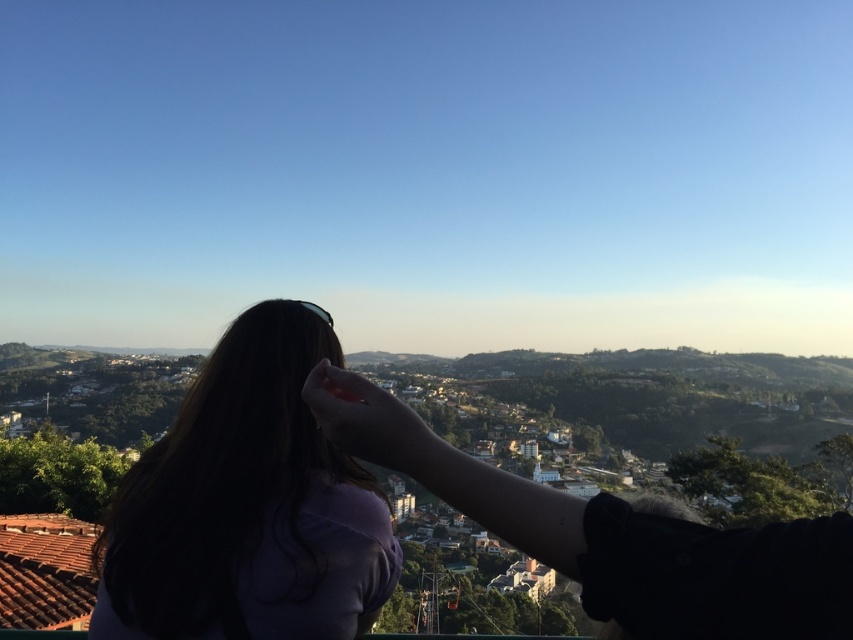
Question: Is dark purple shirt at center positioned before matte pink hand at center?

Choices:
 (A) no
 (B) yes

Answer: (B)

Question: Can you confirm if dark purple shirt at center is positioned below matte pink hand at center?

Choices:
 (A) yes
 (B) no

Answer: (A)

Question: Is dark purple shirt at center wider than matte pink hand at center?

Choices:
 (A) yes
 (B) no

Answer: (A)

Question: Which point is closer to the camera?

Choices:
 (A) dark purple shirt at center
 (B) matte pink hand at center

Answer: (A)